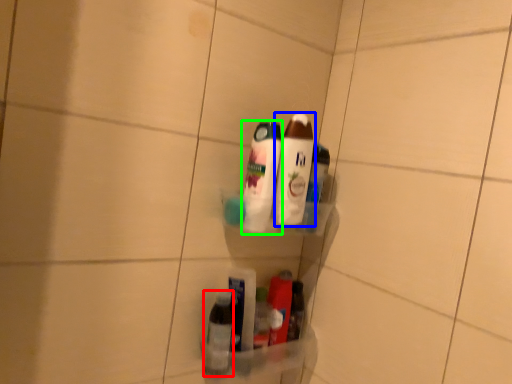
Question: Which is farther away from bottle (highlighted by a red box)? bottle (highlighted by a blue box) or bottle (highlighted by a green box)?

Choices:
 (A) bottle
 (B) bottle

Answer: (A)